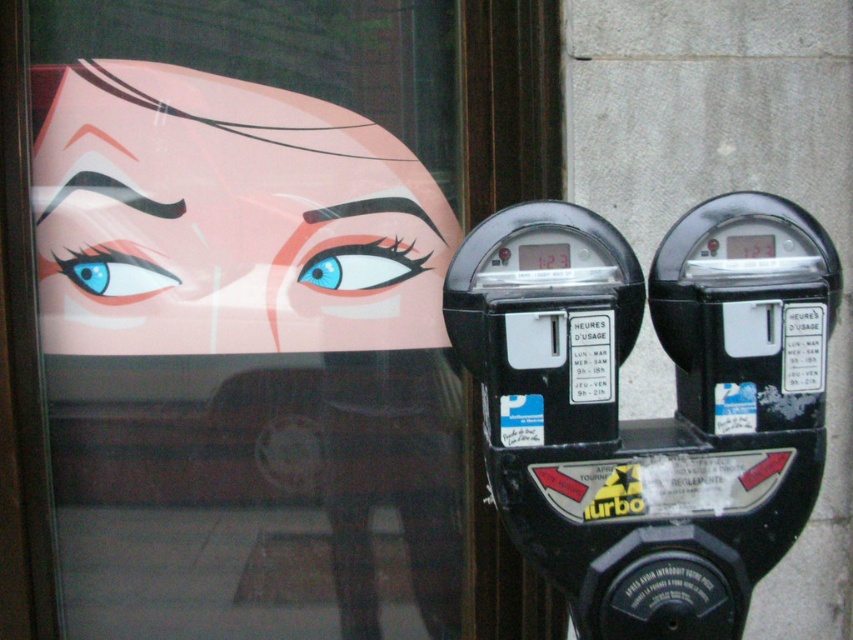
Based on the photo, who is higher up, transparent glass at upper left or black plastic parking meter at right?

transparent glass at upper left is higher up.

Who is more forward, (56, 307) or (728, 634)?

Point (728, 634) is in front.

The image size is (853, 640). In order to click on transparent glass at upper left in this screenshot , I will do `click(260, 312)`.

Who is taller, blue glossy eye at center or matte blue eye at upper left?

Standing taller between the two is matte blue eye at upper left.

Does blue glossy eye at center have a lesser width compared to matte blue eye at upper left?

No.

Is point (329, 276) closer to viewer compared to point (108, 292)?

No, it is behind (108, 292).

This screenshot has height=640, width=853. What are the coordinates of `blue glossy eye at center` in the screenshot? It's located at (361, 266).

Is transparent glass at upper left smaller than matte blue eye at upper left?

Actually, transparent glass at upper left might be larger than matte blue eye at upper left.

From the picture: Can you confirm if transparent glass at upper left is thinner than matte blue eye at upper left?

Incorrect, transparent glass at upper left's width is not less than matte blue eye at upper left's.

Describe the element at coordinates (260, 312) in the screenshot. I see `transparent glass at upper left` at that location.

Identify the location of transparent glass at upper left. (260, 312).